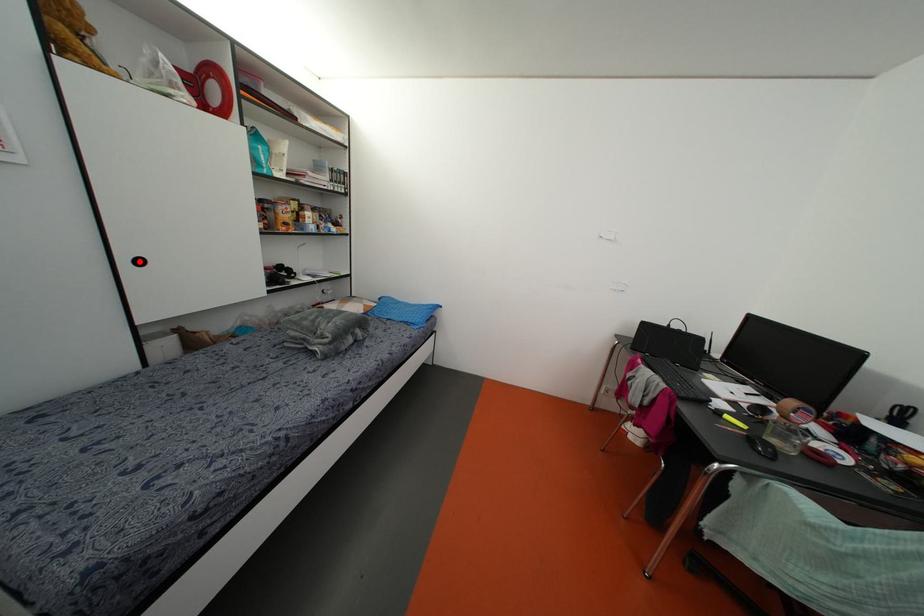
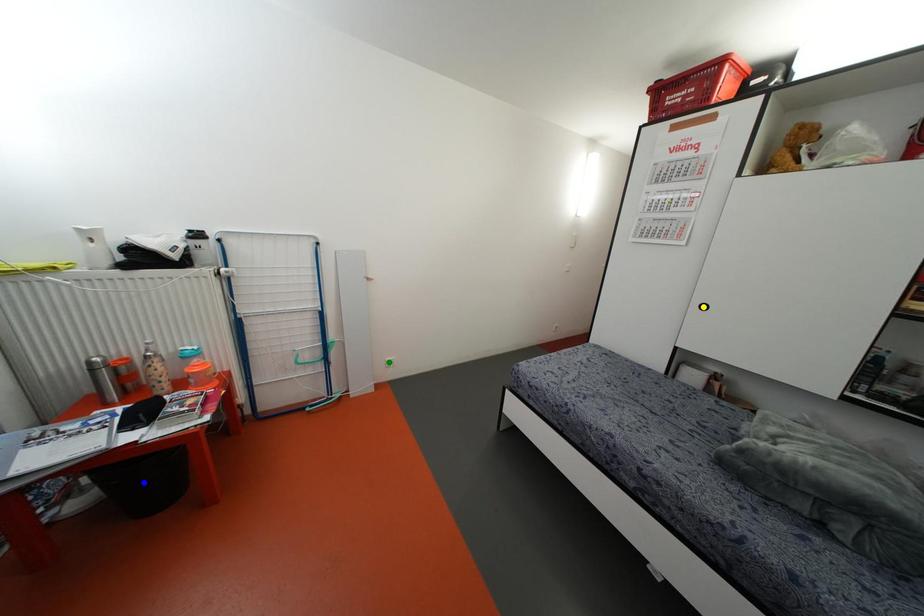
Question: I am providing you with two images of the same scene from different viewpoints. A red point is marked on the first image. You are given multiple points on the second image. In image 2, which mark is for the same physical point as the one in image 1?

Choices:
 (A) green point
 (B) blue point
 (C) yellow point

Answer: (C)